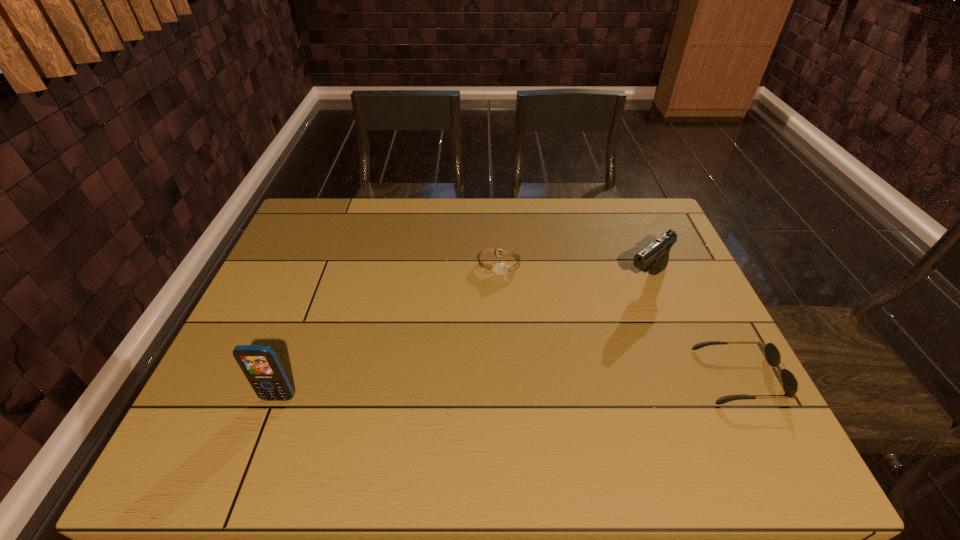
At what (x,y) coordinates should I click in order to perform the action: click on vacant space located on the face of the watch. Please return your answer as a coordinate pair (x, y). This screenshot has height=540, width=960. Looking at the image, I should click on (483, 327).

This screenshot has height=540, width=960. Identify the location of cellular telephone that is at the near edge. (260, 364).

The width and height of the screenshot is (960, 540). I want to click on sunglasses at the near edge, so click(x=772, y=355).

You are a GUI agent. You are given a task and a screenshot of the screen. Output one action in this format:
    pyautogui.click(x=<x>, y=<y>)
    Task: Click on the object at the left edge
    
    Given the screenshot: What is the action you would take?
    pyautogui.click(x=260, y=364)

Find the location of `sunglasses that is at the right edge`. sunglasses that is at the right edge is located at coordinates (772, 355).

In order to click on pistol situated at the right edge in this screenshot , I will do `click(654, 258)`.

The height and width of the screenshot is (540, 960). Identify the location of object present at the near left corner. (260, 364).

In order to click on object that is at the near right corner in this screenshot , I will do `click(772, 355)`.

Locate an element on the screen. The image size is (960, 540). vacant space at the far edge is located at coordinates (470, 200).

Where is `free spot at the near edge of the desktop`? This screenshot has height=540, width=960. free spot at the near edge of the desktop is located at coordinates (656, 420).